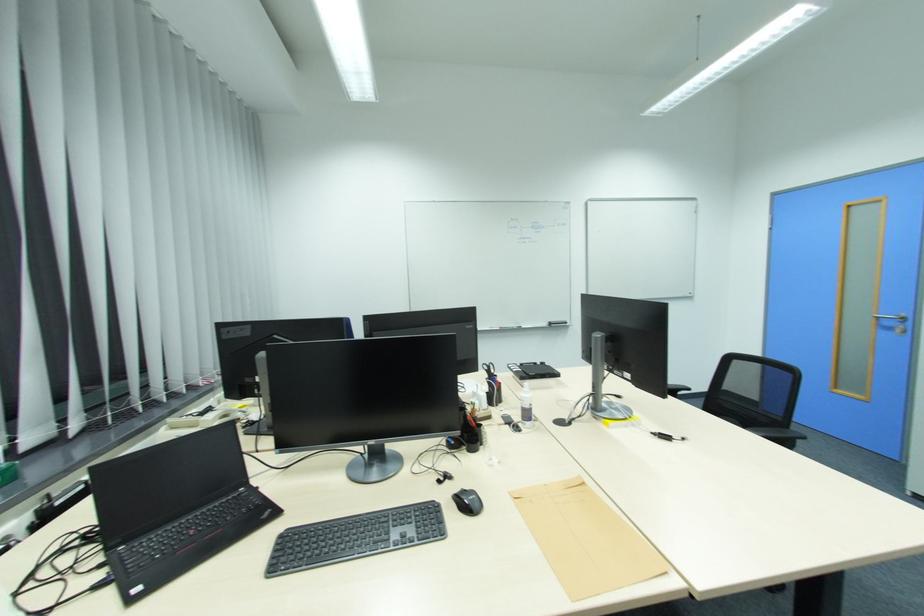
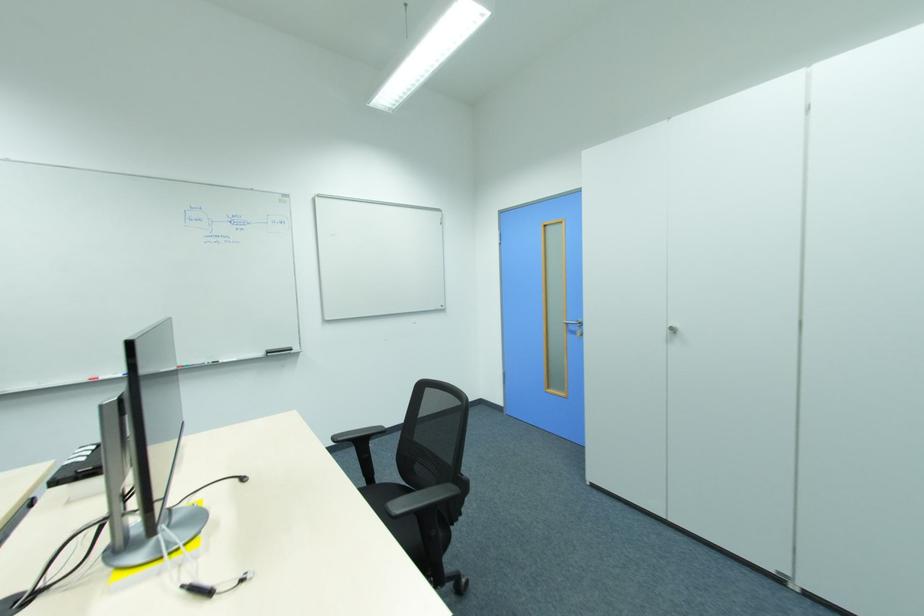
In a continuous first-person perspective shot, in which direction is the camera moving?

The cameraman moved toward right, forward.